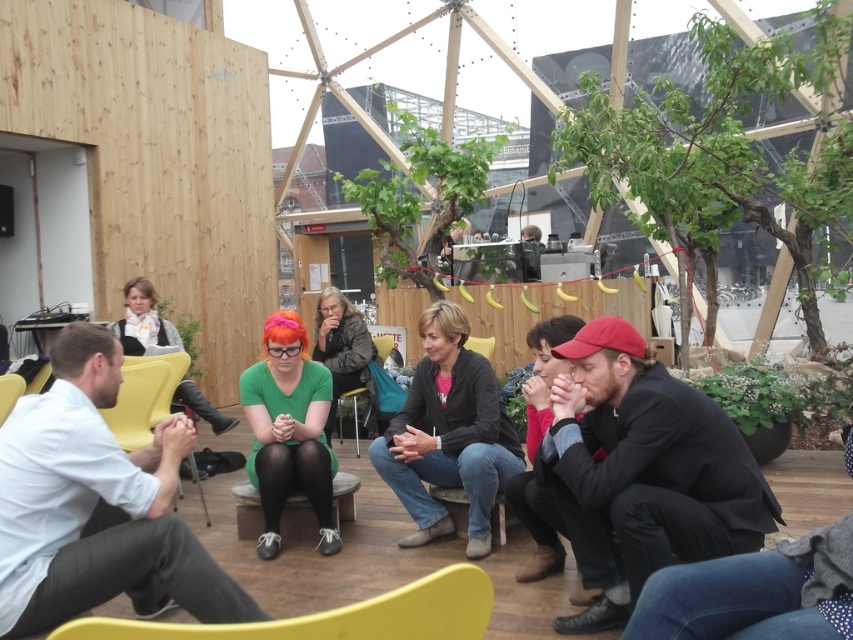
Who is more distant from viewer, (9,531) or (352,401)?

The point (352,401) is behind.

Is light blue shirt at left to the right of green fabric chair at center from the viewer's perspective?

Incorrect, light blue shirt at left is not on the right side of green fabric chair at center.

Locate an element on the screen. light blue shirt at left is located at coordinates (96, 506).

You are a GUI agent. You are given a task and a screenshot of the screen. Output one action in this format:
    pyautogui.click(x=<x>, y=<y>)
    Task: Click on the light blue shirt at left
    This screenshot has height=640, width=853.
    Given the screenshot: What is the action you would take?
    pyautogui.click(x=96, y=506)

Can you confirm if denim jeans at center is bigger than yellow plastic chair at lower left?

Correct, denim jeans at center is larger in size than yellow plastic chair at lower left.

Is denim jeans at center taller than yellow plastic chair at lower left?

Indeed, denim jeans at center has a greater height compared to yellow plastic chair at lower left.

Who is more distant from viewer, (474,424) or (486,612)?

Positioned behind is point (474,424).

Locate an element on the screen. Image resolution: width=853 pixels, height=640 pixels. denim jeans at center is located at coordinates (448, 435).

Between yellow plastic chair at lower left and green fabric chair at center, which one is positioned lower?

green fabric chair at center is lower down.

Is point (471, 611) closer to viewer compared to point (375, 336)?

Yes, it is in front of point (375, 336).

Where is `yellow plastic chair at lower left`? This screenshot has height=640, width=853. yellow plastic chair at lower left is located at coordinates (335, 616).